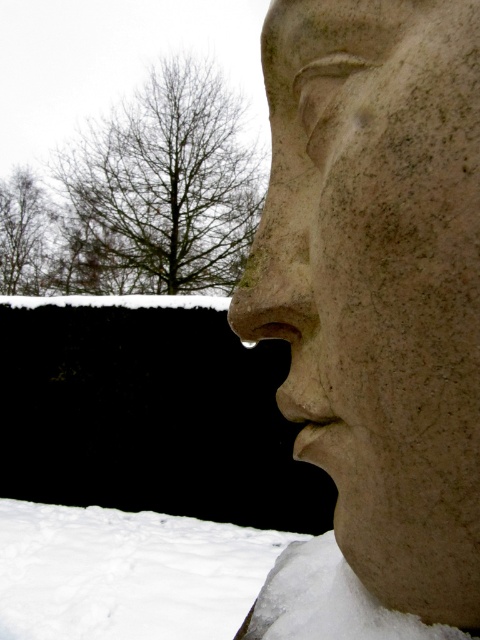
Who is shorter, bare branches at upper center or rough stone nose at center?

rough stone nose at center

Can you confirm if bare branches at upper center is positioned to the left of rough stone nose at center?

Correct, you'll find bare branches at upper center to the left of rough stone nose at center.

Who is more distant from viewer, (x=130, y=252) or (x=249, y=316)?

The point (x=130, y=252) is behind.

Find the location of a particular element. This screenshot has width=480, height=640. bare branches at upper center is located at coordinates (160, 189).

Does bare branches at upper center have a lesser height compared to brown leafless tree at upper left?

Yes.

Does bare branches at upper center appear over brown leafless tree at upper left?

Indeed, bare branches at upper center is positioned over brown leafless tree at upper left.

Is point (82, 228) closer to camera compared to point (41, 285)?

That is False.

The height and width of the screenshot is (640, 480). Find the location of `bare branches at upper center`. bare branches at upper center is located at coordinates (160, 189).

Is granite statue at center taller than white fluffy snow at lower left?

Yes.

Based on the photo, is granite statue at center in front of white fluffy snow at lower left?

Yes, it is in front of white fluffy snow at lower left.

What do you see at coordinates (379, 282) in the screenshot? I see `granite statue at center` at bounding box center [379, 282].

Identify the location of granite statue at center. (379, 282).